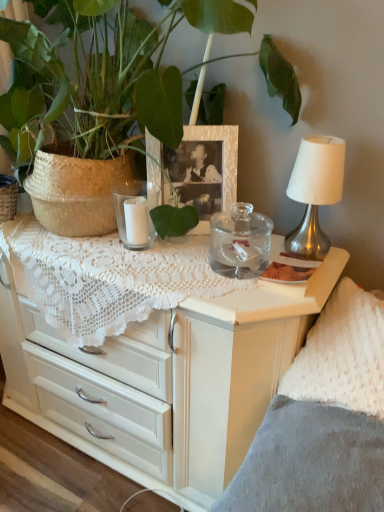
Where is `vacant space that is to the left of white glass candle at center, acting as the 1th candle holder starting from the left`? The height and width of the screenshot is (512, 384). vacant space that is to the left of white glass candle at center, acting as the 1th candle holder starting from the left is located at coordinates (86, 239).